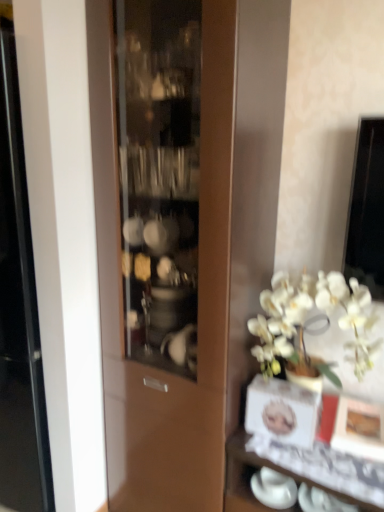
Question: From a real-world perspective, is white glossy cup at lower right above or below white glossy vase at lower right?

Choices:
 (A) below
 (B) above

Answer: (B)

Question: Would you say white glossy cup at lower right is to the left or to the right of white glossy vase at lower right in the picture?

Choices:
 (A) right
 (B) left

Answer: (B)

Question: In terms of size, does white glossy cup at lower right appear bigger or smaller than white glossy vase at lower right?

Choices:
 (A) big
 (B) small

Answer: (B)

Question: From the image's perspective, is white glossy vase at lower right positioned above or below white glossy cup at lower right?

Choices:
 (A) below
 (B) above

Answer: (A)

Question: In the image, is white glossy vase at lower right positioned in front of or behind white glossy cup at lower right?

Choices:
 (A) behind
 (B) front

Answer: (B)

Question: From a real-world perspective, is white glossy vase at lower right above or below white glossy cup at lower right?

Choices:
 (A) above
 (B) below

Answer: (B)

Question: Considering the positions of white glossy vase at lower right and white glossy cup at lower right in the image, is white glossy vase at lower right wider or thinner than white glossy cup at lower right?

Choices:
 (A) thin
 (B) wide

Answer: (B)